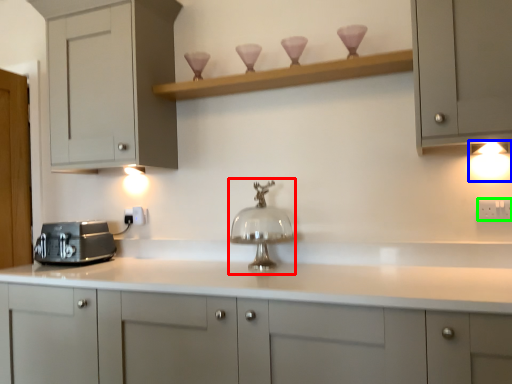
Question: Which object is the farthest from faucet (highlighted by a red box)? Choose among these: light fixture (highlighted by a blue box) or electric outlet (highlighted by a green box).

Choices:
 (A) light fixture
 (B) electric outlet

Answer: (A)